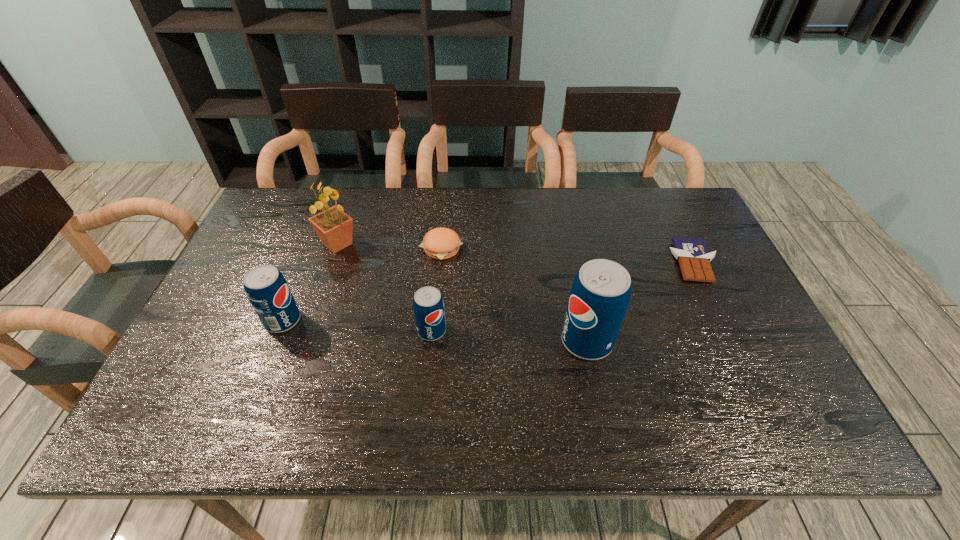
In order to click on the fourth shortest object in this screenshot , I will do `click(266, 288)`.

This screenshot has height=540, width=960. In order to click on the leftmost pop in this screenshot , I will do `click(266, 288)`.

The image size is (960, 540). In order to click on the second pop from left to right in this screenshot , I will do `click(428, 305)`.

At what (x,y) coordinates should I click in order to perform the action: click on the shortest pop. Please return your answer as a coordinate pair (x, y). Looking at the image, I should click on (428, 305).

The width and height of the screenshot is (960, 540). What are the coordinates of `the fifth object from left to right` in the screenshot? It's located at (600, 294).

You are a GUI agent. You are given a task and a screenshot of the screen. Output one action in this format:
    pyautogui.click(x=<x>, y=<y>)
    Task: Click on the rightmost pop
    This screenshot has width=960, height=540.
    Given the screenshot: What is the action you would take?
    pyautogui.click(x=600, y=294)

At what (x,y) coordinates should I click in order to perform the action: click on patty. Please return your answer as a coordinate pair (x, y). Looking at the image, I should click on (442, 243).

Where is `sunflower`? Image resolution: width=960 pixels, height=540 pixels. sunflower is located at coordinates (334, 227).

Find the location of a particular element. The width and height of the screenshot is (960, 540). the rightmost object is located at coordinates (694, 259).

At what (x,y) coordinates should I click in order to perform the action: click on the shortest object. Please return your answer as a coordinate pair (x, y). The image size is (960, 540). Looking at the image, I should click on 694,259.